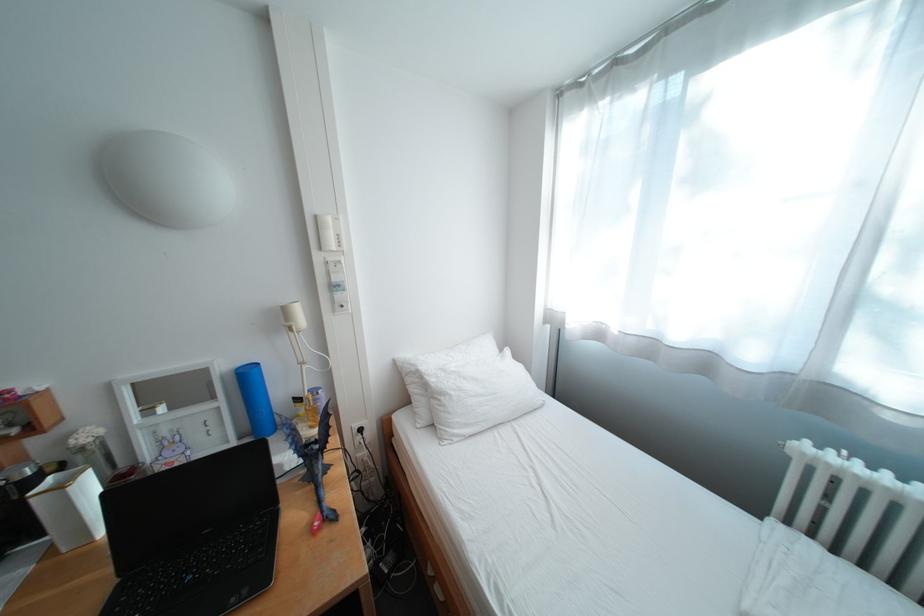
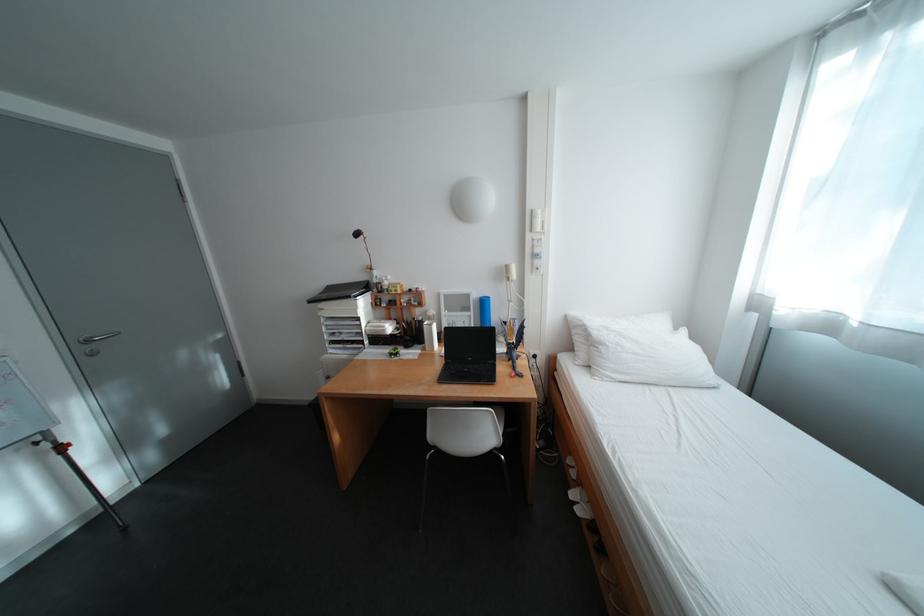
Locate, in the second image, the point that corresponds to the point at 330,257 in the first image.

(541, 237)